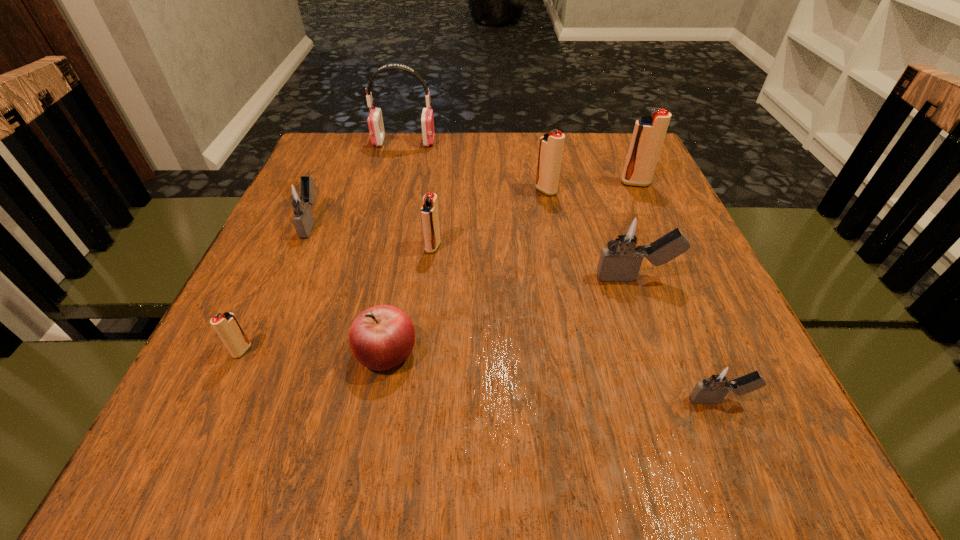
Image resolution: width=960 pixels, height=540 pixels. I want to click on object situated at the far left corner, so click(x=375, y=120).

In order to click on object located at the far right corner in this screenshot , I will do `click(649, 132)`.

Find the location of a particular element. Image resolution: width=960 pixels, height=540 pixels. object located at the near right corner is located at coordinates pos(720,378).

In the image, there is a desktop. At what (x,y) coordinates should I click in order to perform the action: click on vacant region at the far edge. Please return your answer as a coordinate pair (x, y). The height and width of the screenshot is (540, 960). Looking at the image, I should click on (433, 152).

The image size is (960, 540). I want to click on free space at the near edge of the desktop, so tap(613, 446).

Find the location of `vacant point at the left edge`. vacant point at the left edge is located at coordinates (348, 186).

In the image, there is a desktop. Identify the location of free region at the right edge. The image size is (960, 540). (660, 285).

The width and height of the screenshot is (960, 540). I want to click on vacant space at the far left corner of the desktop, so click(341, 135).

Where is `free location at the far right corner of the desktop`? The width and height of the screenshot is (960, 540). free location at the far right corner of the desktop is located at coordinates (589, 156).

Locate an element on the screen. Image resolution: width=960 pixels, height=540 pixels. free space at the near right corner of the desktop is located at coordinates (x=755, y=448).